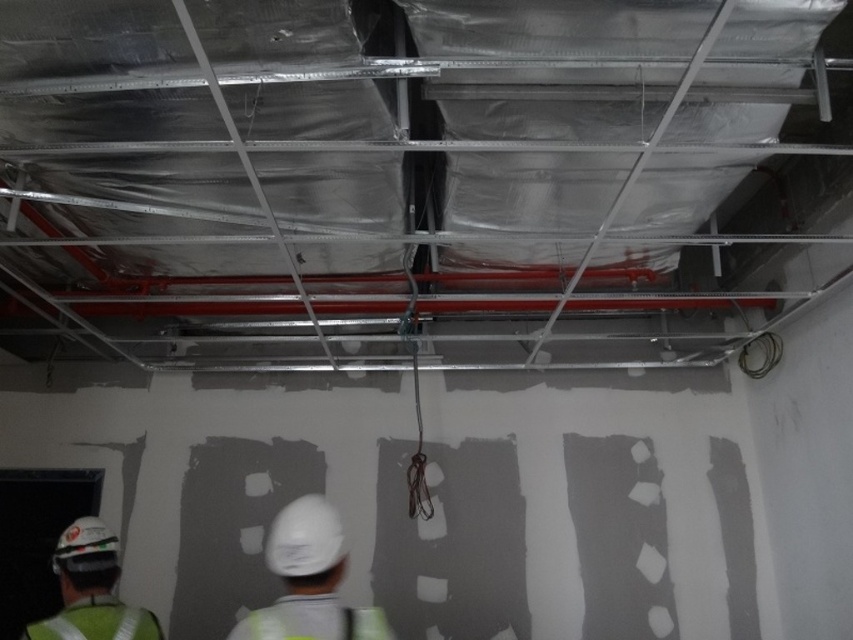
You are an inspector at the construction site and need to determine if the white matte hard hat at center can be stored inside the green reflective safety vest at lower left. Based on their sizes, what would you conclude?

The white matte hard hat at center is bigger than the green reflective safety vest at lower left, so it cannot be stored inside.

You are a construction worker needing to retrieve your safety gear. You see a white hard hat at lower left and a green reflective safety vest at lower left. Can you reach both items without moving your current position if your arms can extend 1.5 inches?

The distance between the white hard hat at lower left and the green reflective safety vest at lower left is 1.71 inches. Since your arms can only extend 1.5 inches, you cannot reach both items simultaneously without moving.